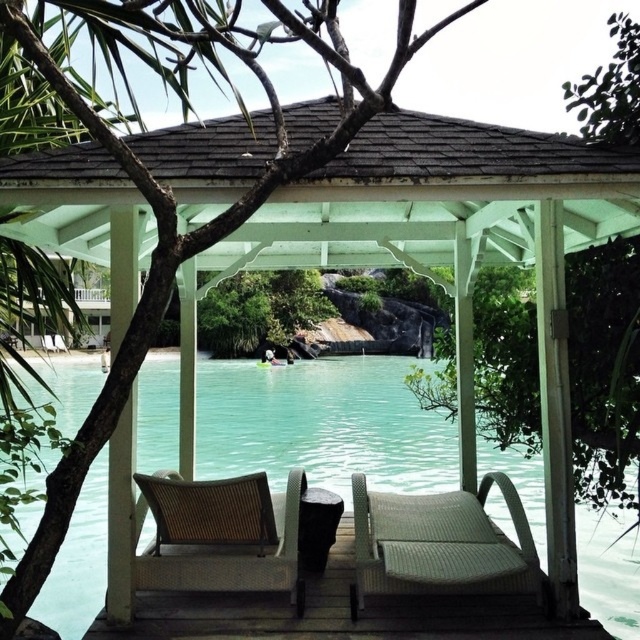
You are planning to take a nap in the gazebo and want to ensure there is enough space between the woven rattan lounge chair at center and the turquoise water at center. Given that the chair is 1.5 meters wide, what is the minimum distance required between them to maintain a safe distance of 2 meters?

The turquoise water at center is larger than the woven rattan lounge chair at center. However, the exact distance between them isn not provided in the description. To maintain a safe distance of 2 meters between the chair and the water, the minimum distance should be at least 2 meters.

You are standing at the entrance of the wooden gazebo and want to know where the turquoise water at center is located. Based on the coordinates provided, can you describe its position relative to the gazebo?

The turquoise water at center is located at coordinates point (323,424), which means it is positioned to the right of the gazebo entrance and slightly forward from the center point of the image.

You are a guest staying at this resort and want to place a tray of drinks between the two chairs. The tray is 12 inches wide. Can you fit it between the woven rattan lounge chair at center and the woven rattan chair at center?

The distance between the woven rattan lounge chair at center and the woven rattan chair at center is 35.86 inches. Since the tray is only 12 inches wide, there is more than enough space to place it between them comfortably.